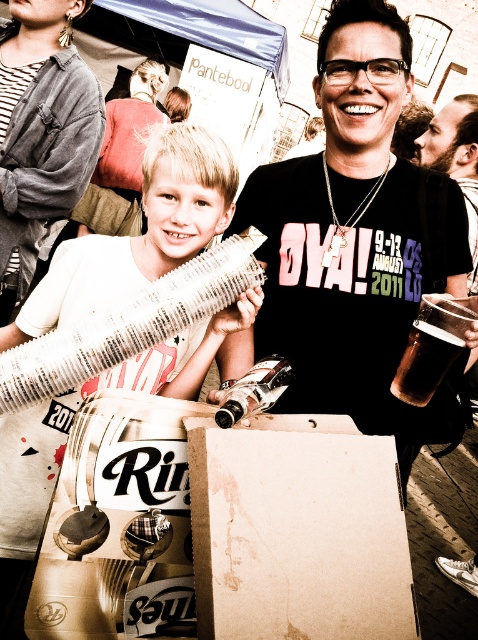
Does white paper accordion at center have a lesser width compared to clear glass bottle at center?

In fact, white paper accordion at center might be wider than clear glass bottle at center.

Which is more to the right, white paper accordion at center or clear glass bottle at center?

From the viewer's perspective, clear glass bottle at center appears more on the right side.

Locate an element on the screen. The height and width of the screenshot is (640, 478). white paper accordion at center is located at coordinates (141, 234).

Identify the location of white paper accordion at center. Image resolution: width=478 pixels, height=640 pixels. (141, 234).

Between brown cardboard box at center and brown matte glass at center, which one is positioned higher?

brown matte glass at center is higher up.

Which is behind, point (322, 600) or point (411, 388)?

The point (411, 388) is more distant.

Is point (279, 584) less distant than point (458, 317)?

Yes, it is.

At what (x,y) coordinates should I click in order to perform the action: click on brown cardboard box at center. Please return your answer as a coordinate pair (x, y). The image size is (478, 640). Looking at the image, I should click on (297, 531).

Can you confirm if black matte t-shirt at center is smaller than brown cardboard box at center?

Actually, black matte t-shirt at center might be larger than brown cardboard box at center.

Who is more forward, (261, 340) or (198, 496)?

Point (198, 496) is more forward.

Find the location of a particular element. The height and width of the screenshot is (640, 478). black matte t-shirt at center is located at coordinates click(x=357, y=241).